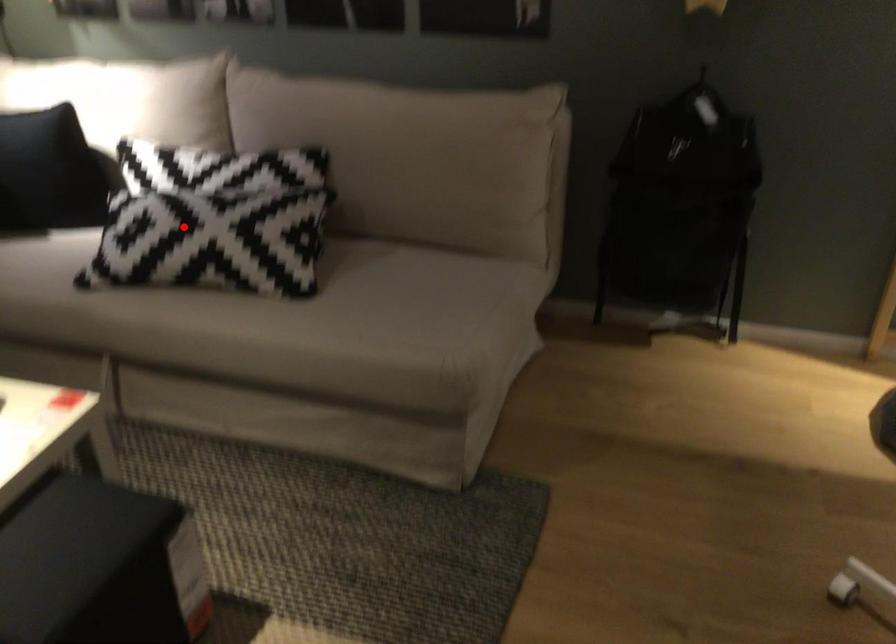
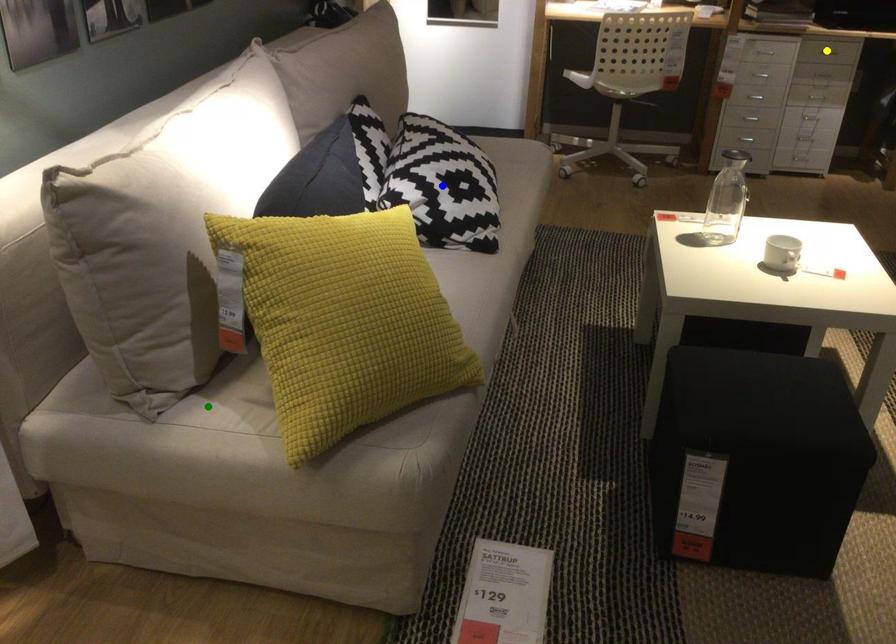
Question: I am providing you with two images of the same scene from different viewpoints. A red point is marked on the first image. You are given multiple points on the second image. Which point in image 2 represents the same 3d spot as the red point in image 1?

Choices:
 (A) yellow point
 (B) blue point
 (C) green point

Answer: (B)